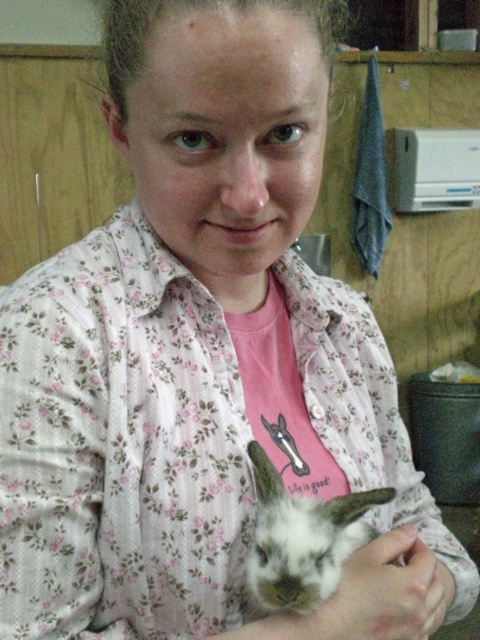
Who is lower down, white fur rabbit at center or white matte hand at lower center?

white matte hand at lower center is below.

Between white fur rabbit at center and white matte hand at lower center, which one is positioned higher?

white fur rabbit at center

Find the location of a particular element. This screenshot has width=480, height=640. white fur rabbit at center is located at coordinates (300, 541).